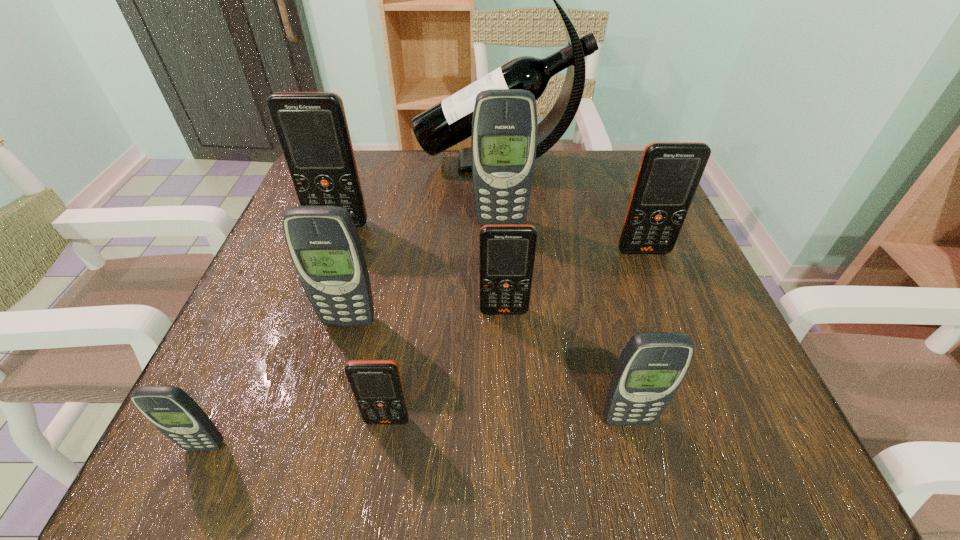
Where is `vacant space located on the stand of the wine bottle`? vacant space located on the stand of the wine bottle is located at coordinates (396, 163).

Find the location of `vacant point located 0.210m on the screen of the biggest orange cellular telephone`. vacant point located 0.210m on the screen of the biggest orange cellular telephone is located at coordinates (308, 308).

The width and height of the screenshot is (960, 540). I want to click on vacant space located 0.130m on the screen of the second gray cellular telephone from right to left, so click(503, 272).

You are a GUI agent. You are given a task and a screenshot of the screen. Output one action in this format:
    pyautogui.click(x=<x>, y=<y>)
    Task: Click on the vacant area located on the screen of the sixth nearest object
    
    Given the screenshot: What is the action you would take?
    [x=721, y=449]

At what (x,y) coordinates should I click in order to perform the action: click on blank space located 0.050m on the screen of the fourth nearest cellular telephone. Please return your answer as a coordinate pair (x, y). The width and height of the screenshot is (960, 540). Looking at the image, I should click on (341, 353).

At what (x,y) coordinates should I click in order to perform the action: click on vacant space located on the screen of the second cellular telephone from right to left. Please return your answer as a coordinate pair (x, y). The width and height of the screenshot is (960, 540). Looking at the image, I should click on (640, 471).

Locate an element on the screen. This screenshot has width=960, height=540. vacant region located on the screen of the second smallest orange cellular telephone is located at coordinates 507,362.

At what (x,y) coordinates should I click in order to perform the action: click on object located in the far edge section of the desktop. Please return your answer as a coordinate pair (x, y). The width and height of the screenshot is (960, 540). Looking at the image, I should click on (449, 122).

Where is `wine bottle that is at the right edge`? wine bottle that is at the right edge is located at coordinates (449, 122).

Where is `object present at the near left corner`? The image size is (960, 540). object present at the near left corner is located at coordinates (173, 412).